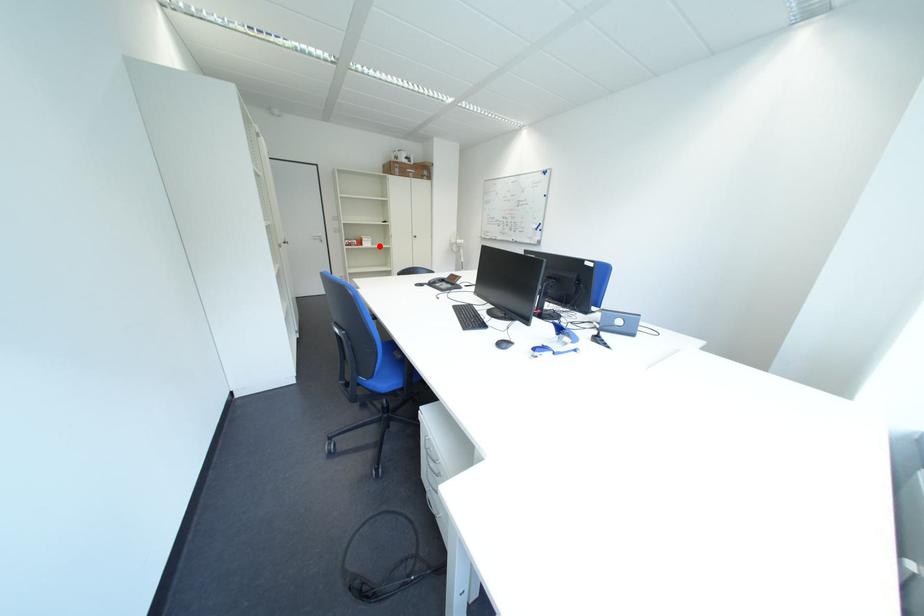
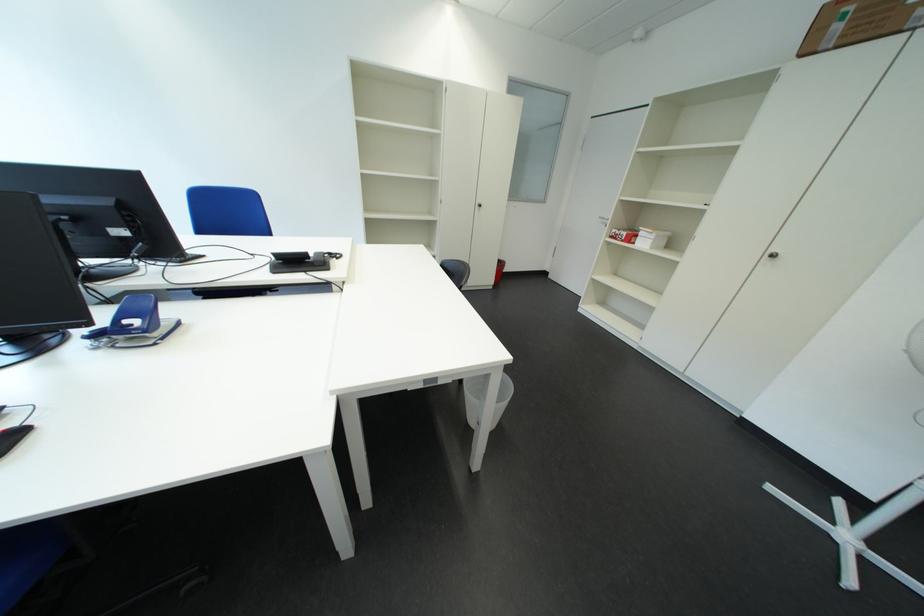
Locate, in the second image, the point that corresponds to the highlighted location in the first image.

(657, 246)